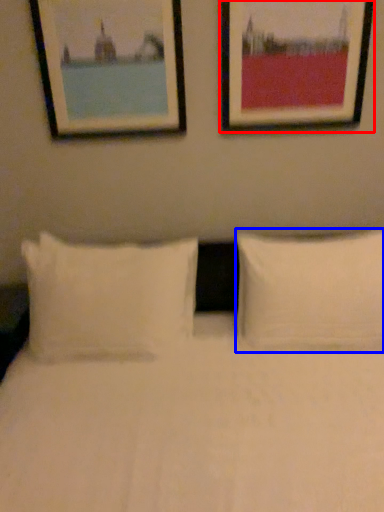
Question: Among these objects, which one is nearest to the camera, picture frame (highlighted by a red box) or pillow (highlighted by a blue box)?

Choices:
 (A) picture frame
 (B) pillow

Answer: (B)